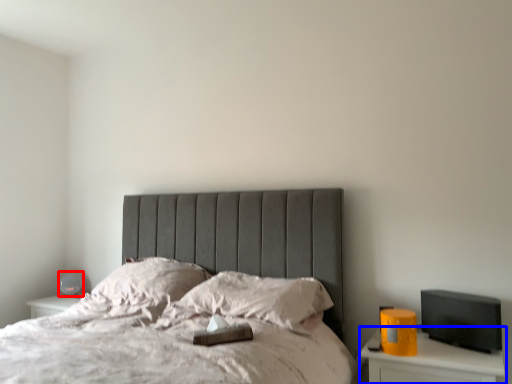
Question: Which object appears closest to the camera in this image, table lamp (highlighted by a red box) or nightstand (highlighted by a blue box)?

Choices:
 (A) table lamp
 (B) nightstand

Answer: (B)